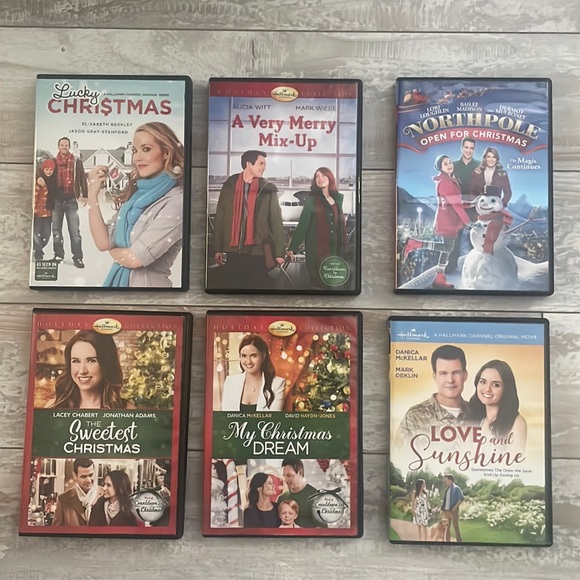
The height and width of the screenshot is (580, 580). I want to click on dvd, so click(x=92, y=209), click(x=245, y=211), click(x=456, y=199), click(x=113, y=405), click(x=295, y=408), click(x=483, y=419).